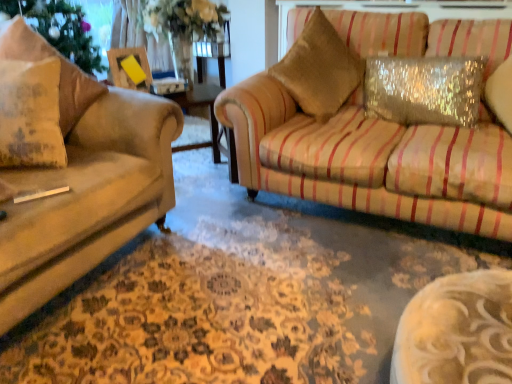
Question: Is sparkly silver pillow at upper right, placed as the 3th pillow when sorted from left to right, positioned before gold textured pillow at upper right?

Choices:
 (A) yes
 (B) no

Answer: (A)

Question: Does sparkly silver pillow at upper right, which is the first pillow in right-to-left order, touch gold textured pillow at upper right?

Choices:
 (A) yes
 (B) no

Answer: (B)

Question: Can you confirm if sparkly silver pillow at upper right, placed as the 3th pillow when sorted from left to right, is shorter than gold textured pillow at upper right?

Choices:
 (A) no
 (B) yes

Answer: (B)

Question: From the image's perspective, does sparkly silver pillow at upper right, placed as the 3th pillow when sorted from left to right, appear higher than gold textured pillow at upper right?

Choices:
 (A) no
 (B) yes

Answer: (A)

Question: From a real-world perspective, is sparkly silver pillow at upper right, placed as the 3th pillow when sorted from left to right, physically below gold textured pillow at upper right?

Choices:
 (A) yes
 (B) no

Answer: (A)

Question: Is sparkly silver pillow at upper right, which is the first pillow in right-to-left order, facing away from gold textured pillow at upper right?

Choices:
 (A) yes
 (B) no

Answer: (B)

Question: Does textured beige pillow at left, which is the second pillow in right-to-left order, come in front of matte beige pillow at left, the third pillow in the right-to-left sequence?

Choices:
 (A) yes
 (B) no

Answer: (A)

Question: Does textured beige pillow at left, the 2th pillow positioned from the left, have a smaller size compared to matte beige pillow at left, the 1th pillow viewed from the left?

Choices:
 (A) no
 (B) yes

Answer: (A)

Question: Is textured beige pillow at left, which is the second pillow in right-to-left order, outside matte beige pillow at left, the 1th pillow viewed from the left?

Choices:
 (A) yes
 (B) no

Answer: (A)

Question: Is textured beige pillow at left, the 2th pillow positioned from the left, bigger than matte beige pillow at left, the 1th pillow viewed from the left?

Choices:
 (A) no
 (B) yes

Answer: (B)

Question: Is textured beige pillow at left, which is the second pillow in right-to-left order, positioned far away from matte beige pillow at left, the third pillow in the right-to-left sequence?

Choices:
 (A) yes
 (B) no

Answer: (B)

Question: From a real-world perspective, is textured beige pillow at left, which is the second pillow in right-to-left order, positioned over matte beige pillow at left, the third pillow in the right-to-left sequence, based on gravity?

Choices:
 (A) no
 (B) yes

Answer: (B)

Question: Is sparkly silver pillow at upper right, which is the first pillow in right-to-left order, surrounding textured beige pillow at left, which is the second pillow in right-to-left order?

Choices:
 (A) yes
 (B) no

Answer: (B)